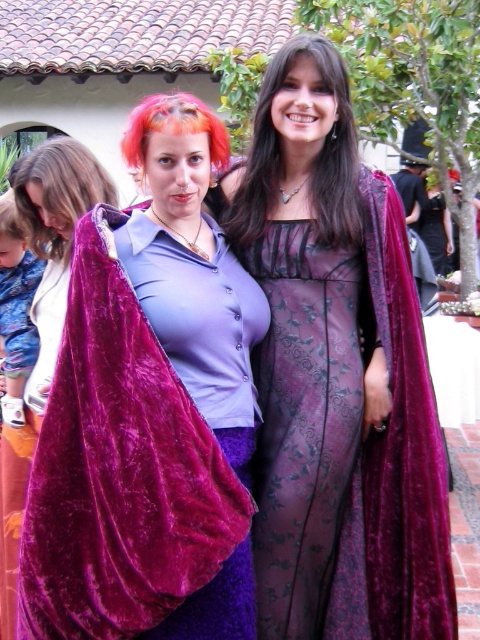
You are a photographer at an event and need to ensure both the blonde hair at left and the brown matte hair at center are visible in the photo. Given that the camera can only focus on one person at a time, which person should you focus on to capture both hairs in the frame?

The camera should focus on the blonde hair at left because it is larger in size than the brown matte hair at center, making it easier to include both in the frame.

You are organizing a costume party and need to ensure that the velvet cape at left and the brown matte hair at center can fit through a narrow doorway. Based on the image, which object is wider and would require more space when passing through?

The velvet cape at left is wider than the brown matte hair at center, so it would require more space when passing through the doorway.

You are a photographer at an event and need to ensure both subjects are fully visible in the frame. Given that the velvet cape at left and the brown matte hair at center are in your shot, which one might require you to adjust your framing to accommodate its size?

The velvet cape at left has a larger size compared to the brown matte hair at center, so you would need to adjust the framing to accommodate the velvet cape at left.